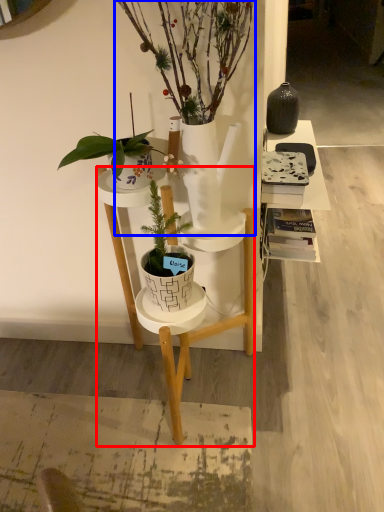
Question: Which object is further to the camera taking this photo, desk (highlighted by a red box) or houseplant (highlighted by a blue box)?

Choices:
 (A) desk
 (B) houseplant

Answer: (A)